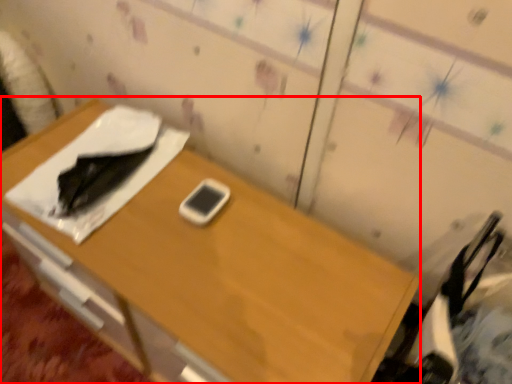
Question: From the image, what is the correct spatial relationship of desk (annotated by the red box) in relation to mobile phone?

Choices:
 (A) left
 (B) right

Answer: (A)